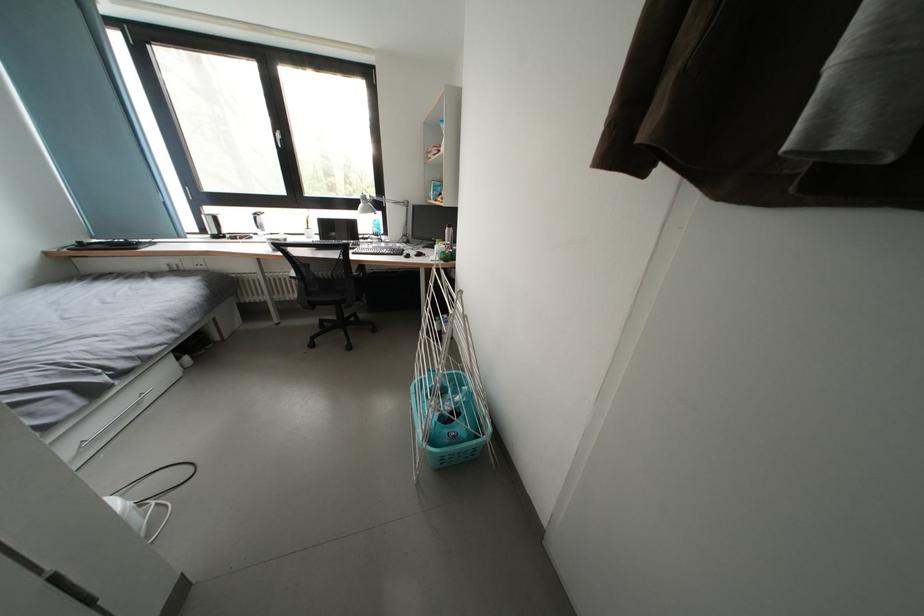
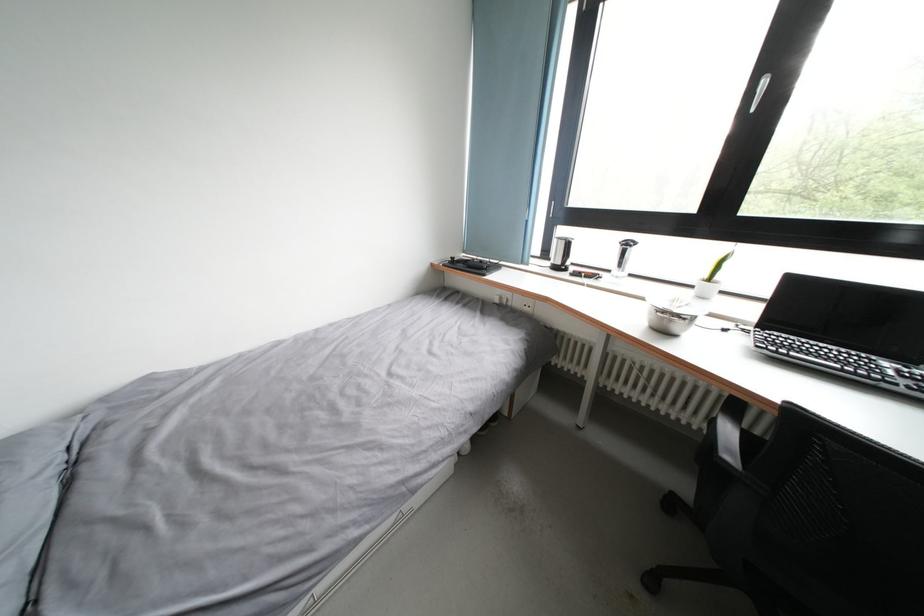
In the second image, find the point that corresponds to (x=195, y=270) in the first image.

(524, 308)